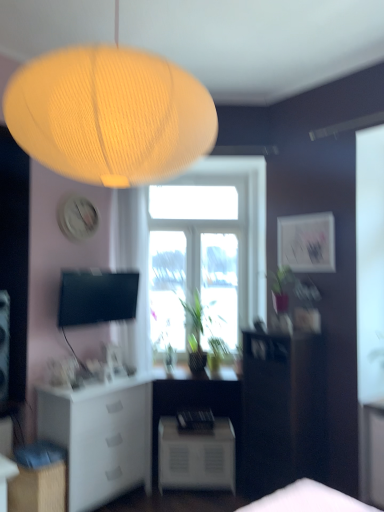
What is the approximate width of matte white picture frame at upper right?

matte white picture frame at upper right is 1.21 inches wide.

In order to face white matte cabinet at lower left, marked as the 1th cabinetry in a front-to-back arrangement, should I rotate leftwards or rightwards?

Rotate your view left by about 20.449°.

What do you see at coordinates (101, 437) in the screenshot? I see `white matte cabinet at lower left, the 2th cabinetry from the front` at bounding box center [101, 437].

Describe the element at coordinates (196, 456) in the screenshot. The height and width of the screenshot is (512, 384). I see `white matte nightstand at lower center` at that location.

In order to face dark wood cabinet at right, should I rotate leftwards or rightwards?

To face it directly, rotate right by 12.203 degrees.

Locate an element on the screen. transparent glass window at center is located at coordinates (207, 250).

Which object is more forward, transparent glass window at center or white matte cabinet at lower left, the 2th cabinetry from the front?

white matte cabinet at lower left, the 2th cabinetry from the front, is more forward.

Is transparent glass window at center far away from white matte cabinet at lower left, which is the first cabinetry from back to front?

Yes, transparent glass window at center and white matte cabinet at lower left, which is the first cabinetry from back to front, are quite far apart.

Considering the positions of objects transparent glass window at center and white matte cabinet at lower left, which is the first cabinetry from back to front, in the image provided, who is more to the right, transparent glass window at center or white matte cabinet at lower left, which is the first cabinetry from back to front,?

From the viewer's perspective, transparent glass window at center appears more on the right side.

Find the location of a particular element. Image resolution: width=384 pixels, height=512 pixels. window behind the white matte cabinet at lower left, which is the first cabinetry from back to front is located at coordinates (207, 250).

I want to click on nightstand on the left of dark wood cabinet at right, so click(196, 456).

From a real-world perspective, between white matte nightstand at lower center and dark wood cabinet at right, who is vertically higher?

In real-world perspective, dark wood cabinet at right is above.

Which point is more distant from viewer, (191, 481) or (248, 434)?

Positioned behind is point (191, 481).

Is the position of white matte nightstand at lower center less distant than that of dark wood cabinet at right?

No, it is not.

From the image's perspective, would you say dark wood cabinet at right is positioned over matte white picture frame at upper right?

No, from the image's perspective, dark wood cabinet at right is not above matte white picture frame at upper right.

In the scene shown: Which object is positioned more to the right, dark wood cabinet at right or matte white picture frame at upper right?

matte white picture frame at upper right is more to the right.

Between dark wood cabinet at right and matte white picture frame at upper right, which one has smaller width?

Thinner between the two is matte white picture frame at upper right.

Looking at this image, can you confirm if white matte nightstand at lower center is wider than matte white picture frame at upper right?

Yes.

Consider the image. Who is shorter, white matte nightstand at lower center or matte white picture frame at upper right?

With less height is matte white picture frame at upper right.

Consider the image. Can you confirm if white matte nightstand at lower center is bigger than matte white picture frame at upper right?

Yes, white matte nightstand at lower center is bigger than matte white picture frame at upper right.

Measure the distance between dark wood cabinet at right and white matte cabinet at lower left, which is the first cabinetry from back to front.

A distance of 1.10 meters exists between dark wood cabinet at right and white matte cabinet at lower left, which is the first cabinetry from back to front.

Which point is more distant from viewer, (286, 407) or (123, 413)?

The point (123, 413) is more distant.

Can you tell me how much dark wood cabinet at right and white matte cabinet at lower left, which is the first cabinetry from back to front, differ in facing direction?

There is a 101-degree angle between the facing directions of dark wood cabinet at right and white matte cabinet at lower left, which is the first cabinetry from back to front.

Considering the relative sizes of dark wood cabinet at right and white matte cabinet at lower left, the 2th cabinetry from the front, in the image provided, is dark wood cabinet at right shorter than white matte cabinet at lower left, the 2th cabinetry from the front,?

In fact, dark wood cabinet at right may be taller than white matte cabinet at lower left, the 2th cabinetry from the front.

Between matte yellow paper lamp at upper center and matte white picture frame at upper right, which one has larger size?

With larger size is matte yellow paper lamp at upper center.

Which object is more forward, matte yellow paper lamp at upper center or matte white picture frame at upper right?

matte yellow paper lamp at upper center is in front.

Is matte yellow paper lamp at upper center to the right of matte white picture frame at upper right from the viewer's perspective?

No, matte yellow paper lamp at upper center is not to the right of matte white picture frame at upper right.

Is matte yellow paper lamp at upper center aimed at matte white picture frame at upper right?

No, matte yellow paper lamp at upper center is not facing towards matte white picture frame at upper right.

From the image's perspective, which one is positioned lower, matte white picture frame at upper right or matte yellow paper lamp at upper center?

matte white picture frame at upper right.

Which is behind, point (301, 234) or point (32, 151)?

The point (301, 234) is behind.

Can you confirm if matte white picture frame at upper right is shorter than matte yellow paper lamp at upper center?

Correct, matte white picture frame at upper right is not as tall as matte yellow paper lamp at upper center.

Is matte white picture frame at upper right positioned before matte yellow paper lamp at upper center?

No, it is not.

From a real-world perspective, count 1st cabinetrys downward from the transparent glass window at center and point to it. Please provide its 2D coordinates.

[(101, 437)]

This screenshot has width=384, height=512. In order to click on furniture on the right of the white matte nightstand at lower center in this screenshot , I will do `click(282, 410)`.

Based on their spatial positions, is white matte cabinet at lower left, marked as the 1th cabinetry in a front-to-back arrangement, or matte white picture frame at upper right closer to dark wood cabinet at right?

The object closer to dark wood cabinet at right is matte white picture frame at upper right.

When comparing their distances from white matte nightstand at lower center, does dark wood cabinet at right or white matte cabinet at lower left, positioned as the 2th cabinetry in back-to-front order, seem further?

white matte cabinet at lower left, positioned as the 2th cabinetry in back-to-front order, lies further to white matte nightstand at lower center than the other object.

When comparing their distances from white matte cabinet at lower left, positioned as the 2th cabinetry in back-to-front order, does transparent glass window at center or white matte nightstand at lower center seem closer?

white matte nightstand at lower center.

Based on their spatial positions, is white matte nightstand at lower center or transparent glass window at center further from white matte cabinet at lower left, marked as the 1th cabinetry in a front-to-back arrangement?

transparent glass window at center.

From the image, which object appears to be nearer to white matte cabinet at lower left, which is the first cabinetry from back to front, white matte cabinet at lower left, positioned as the 2th cabinetry in back-to-front order, or dark wood cabinet at right?

Among the two, white matte cabinet at lower left, positioned as the 2th cabinetry in back-to-front order, is located nearer to white matte cabinet at lower left, which is the first cabinetry from back to front.

Considering their positions, is dark wood cabinet at right positioned further to white matte cabinet at lower left, which is the first cabinetry from back to front, than white matte nightstand at lower center?

dark wood cabinet at right is further to white matte cabinet at lower left, which is the first cabinetry from back to front.

Which object lies nearer to the anchor point dark wood cabinet at right, matte white picture frame at upper right or white matte cabinet at lower left, which is the first cabinetry from back to front?

matte white picture frame at upper right.

Based on their spatial positions, is transparent glass window at center or dark wood cabinet at right further from white matte cabinet at lower left, which is the first cabinetry from back to front?

Based on the image, transparent glass window at center appears to be further to white matte cabinet at lower left, which is the first cabinetry from back to front.

Locate an element on the screen. This screenshot has height=512, width=384. furniture between matte yellow paper lamp at upper center and white matte cabinet at lower left, positioned as the 2th cabinetry in back-to-front order, in the up-down direction is located at coordinates (282, 410).

Locate an element on the screen. furniture that lies between transparent glass window at center and white matte nightstand at lower center from top to bottom is located at coordinates (282, 410).

You are a GUI agent. You are given a task and a screenshot of the screen. Output one action in this format:
    pyautogui.click(x=<x>, y=<y>)
    Task: Click on the furniture between matte yellow paper lamp at upper center and transparent glass window at center in the front-back direction
    
    Given the screenshot: What is the action you would take?
    pyautogui.click(x=282, y=410)

Find the location of a particular element. This screenshot has height=512, width=384. furniture located between white matte cabinet at lower left, the 2th cabinetry from the front, and transparent glass window at center in the depth direction is located at coordinates (282, 410).